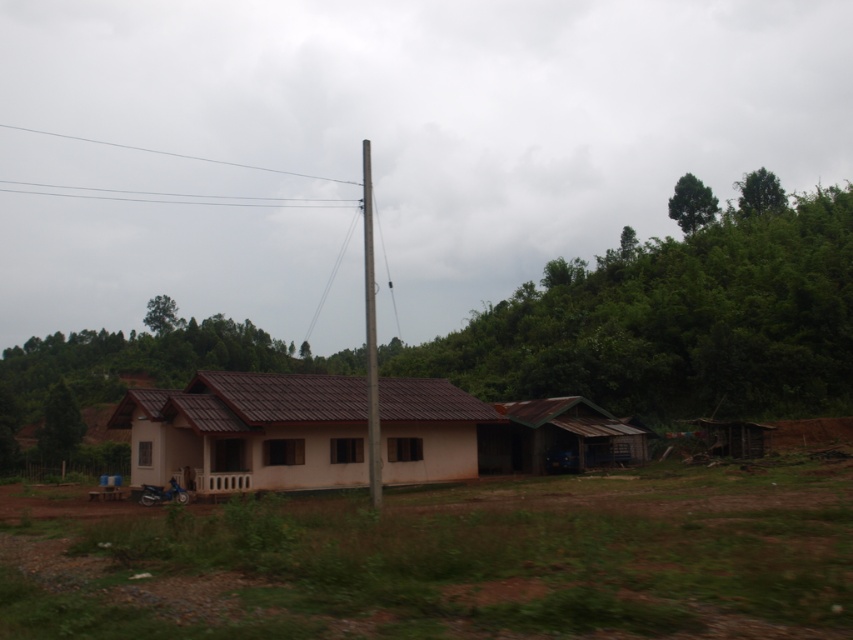
You are a painter who needs to assess the height of the structures in the image. Which structure is taller, the brown matte house at center or the rusty corrugated tin hut at lower right?

The brown matte house at center is much taller than the rusty corrugated tin hut at lower right.

You are a delivery person trying to navigate through the area. You need to deliver a package to the main house. There is a rusty corrugated tin hut at lower right and a metallic pole at center. Which object is closer to the main house?

The rusty corrugated tin hut at lower right is closer to the main house than the metallic pole at center because it is smaller in size, indicating proximity.

You are a delivery person trying to navigate through the area. You need to deliver a package to the rusty corrugated tin hut at lower right. From your current position near the metallic pole at center, in which direction should you move to reach the destination?

The rusty corrugated tin hut at lower right is below the metallic pole at center, so you should move downward or southward from the metallic pole at center to reach the rusty corrugated tin hut at lower right.